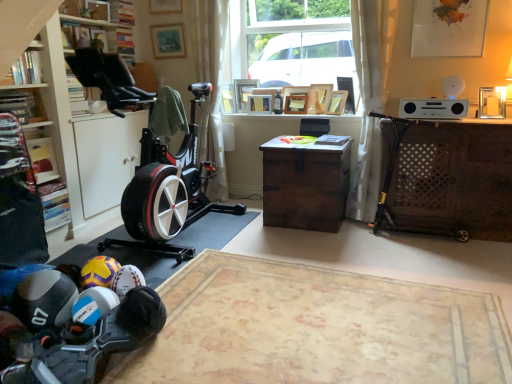
Question: Does brown wooden desk at center, the 1th desk in the left-to-right sequence, lie in front of white sheer curtain at right, which ranks as the 2th curtain in left-to-right order?

Choices:
 (A) no
 (B) yes

Answer: (A)

Question: From a real-world perspective, is brown wooden desk at center, the 1th desk in the left-to-right sequence, on white sheer curtain at right, which ranks as the 2th curtain in left-to-right order?

Choices:
 (A) no
 (B) yes

Answer: (A)

Question: From the image's perspective, is brown wooden desk at center, positioned as the second desk in right-to-left order, located beneath white sheer curtain at right, arranged as the first curtain when viewed from the right?

Choices:
 (A) yes
 (B) no

Answer: (A)

Question: Is brown wooden desk at center, positioned as the second desk in right-to-left order, positioned with its back to white sheer curtain at right, arranged as the first curtain when viewed from the right?

Choices:
 (A) yes
 (B) no

Answer: (B)

Question: Is brown wooden desk at center, positioned as the second desk in right-to-left order, not near white sheer curtain at right, arranged as the first curtain when viewed from the right?

Choices:
 (A) yes
 (B) no

Answer: (B)

Question: From the image's perspective, would you say brown wooden desk at center, the 1th desk in the left-to-right sequence, is positioned over white sheer curtain at right, which ranks as the 2th curtain in left-to-right order?

Choices:
 (A) no
 (B) yes

Answer: (A)

Question: Is brown wooden desk at center, positioned as the second desk in right-to-left order, positioned with its back to wooden picture frame at upper center, placed as the 2th picture frame when sorted from left to right?

Choices:
 (A) yes
 (B) no

Answer: (B)

Question: Does brown wooden desk at center, the 1th desk in the left-to-right sequence, have a greater width compared to wooden picture frame at upper center, the 6th picture frame in the right-to-left sequence?

Choices:
 (A) no
 (B) yes

Answer: (B)

Question: Can you confirm if brown wooden desk at center, positioned as the second desk in right-to-left order, is bigger than wooden picture frame at upper center, placed as the 2th picture frame when sorted from left to right?

Choices:
 (A) yes
 (B) no

Answer: (A)

Question: Does brown wooden desk at center, positioned as the second desk in right-to-left order, appear on the left side of wooden picture frame at upper center, placed as the 2th picture frame when sorted from left to right?

Choices:
 (A) yes
 (B) no

Answer: (B)

Question: From the image's perspective, does brown wooden desk at center, positioned as the second desk in right-to-left order, appear lower than wooden picture frame at upper center, placed as the 2th picture frame when sorted from left to right?

Choices:
 (A) yes
 (B) no

Answer: (A)

Question: Considering the relative sizes of brown wooden desk at center, the 1th desk in the left-to-right sequence, and wooden picture frame at upper center, the 6th picture frame in the right-to-left sequence, in the image provided, is brown wooden desk at center, the 1th desk in the left-to-right sequence, smaller than wooden picture frame at upper center, the 6th picture frame in the right-to-left sequence,?

Choices:
 (A) no
 (B) yes

Answer: (A)

Question: From the image's perspective, is white sheer curtain at right, arranged as the first curtain when viewed from the right, on top of rubberized black shoe at lower left, the 1th toy when ordered from front to back?

Choices:
 (A) yes
 (B) no

Answer: (A)